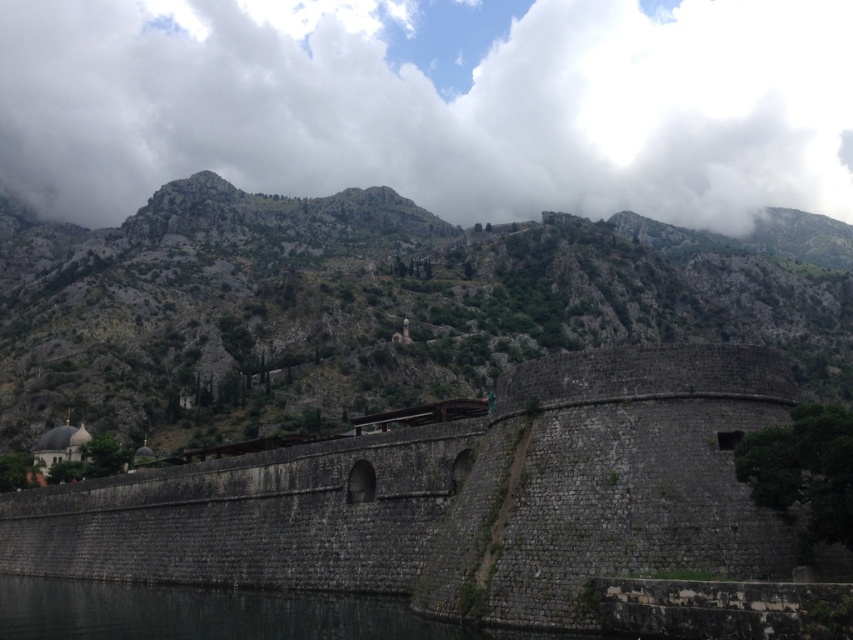
You are a hiker standing at the base of the rugged stone mountain at center and want to reach the dark gray water at lower left. Which direction should you move to get closer to the water?

The rugged stone mountain at center is closer to you than the dark gray water at lower left. To reach the dark gray water at lower left, you should move away from the mountain towards the lower left direction.

You are an astronomer analyzing the image of the mountainous landscape. You need to determine the position of the white fluffy cloud at upper center in the image. What are its coordinates?

The white fluffy cloud at upper center is located at coordinates [433,106].

You are a hiker standing at the dark stone wall at center. You want to reach the rugged stone mountain at center. Given that your average walking speed is 3 km per hour, how long will it take you to reach the mountain?

The distance between the rugged stone mountain at center and the dark stone wall at center is 170.04 meters. To convert meters to kilometers, divide by 1000, so 170.04 meters is 0.17004 kilometers. At a speed of 3 km per hour, time equals distance divided by speed, so 0.17004 divided by 3 equals approximately 0.0567 hours. Multiplying by 60 minutes gives about 3.4 minutes. Therefore, it will take approximately 3.4 minutes to reach the rugged stone mountain at center.